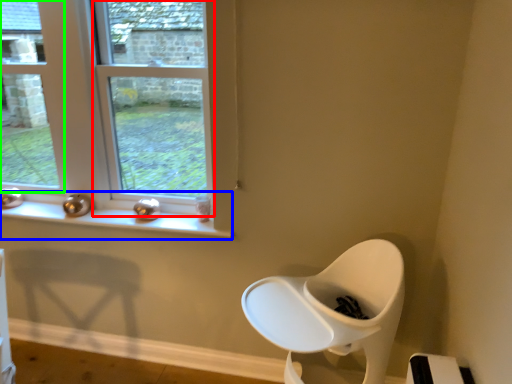
Question: Which object is the closest to the window (highlighted by a red box)? Choose among these: window sill (highlighted by a blue box) or window (highlighted by a green box).

Choices:
 (A) window sill
 (B) window

Answer: (A)